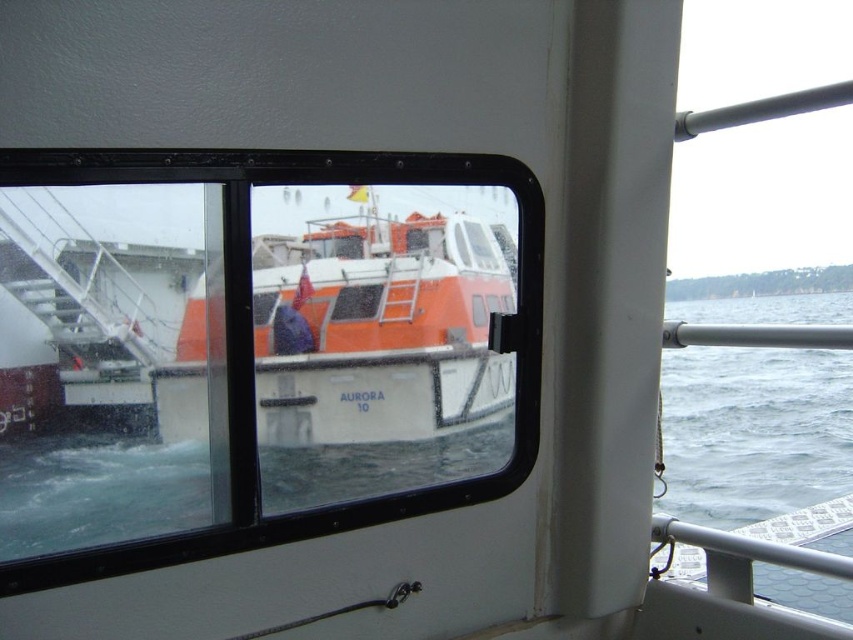
Does orange matte boat at center have a lesser width compared to gray water at lower right?

Yes, orange matte boat at center is thinner than gray water at lower right.

Image resolution: width=853 pixels, height=640 pixels. Describe the element at coordinates (383, 330) in the screenshot. I see `orange matte boat at center` at that location.

Who is more distant from viewer, (386, 241) or (850, 412)?

The point (850, 412) is behind.

Where is `orange matte boat at center`? This screenshot has height=640, width=853. orange matte boat at center is located at coordinates (383, 330).